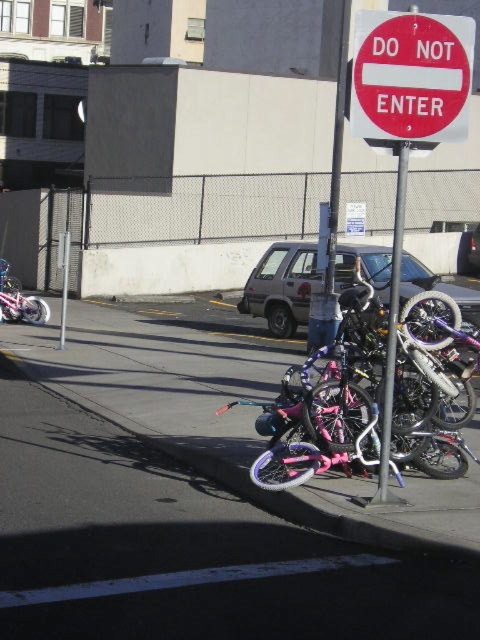
Question: In this image, where is metallic pole at center located relative to brushed metal motorcycle at left?

Choices:
 (A) left
 (B) right

Answer: (B)

Question: Based on their relative distances, which object is farther from the pink metallic bicycle at center?

Choices:
 (A) metallic pole at center
 (B) brushed metal motorcycle at left
 (C) silver metallic suv at center
 (D) silver metallic car at center

Answer: (D)

Question: Among these objects, which one is farthest from the camera?

Choices:
 (A) pink metallic bicycle at center
 (B) brushed metal motorcycle at left
 (C) pink matte bicycle at center
 (D) metallic pole at center

Answer: (B)

Question: Can you confirm if silver metallic suv at center is wider than silver metallic car at center?

Choices:
 (A) no
 (B) yes

Answer: (A)

Question: Is silver metallic suv at center positioned before silver metallic car at center?

Choices:
 (A) no
 (B) yes

Answer: (B)

Question: Which of the following is the farthest from the observer?

Choices:
 (A) (34, 323)
 (B) (442, 412)

Answer: (A)